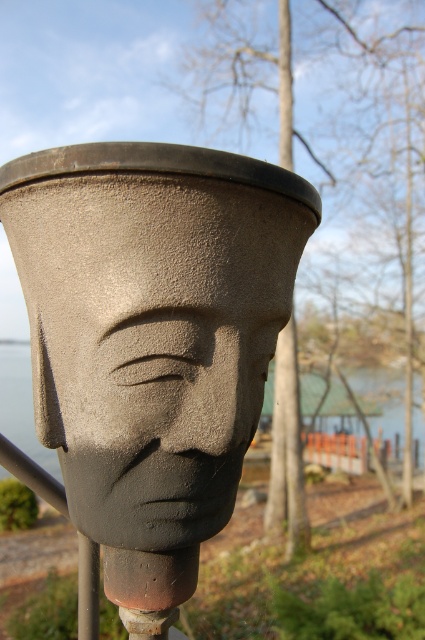
Question: Can you confirm if matte gray stone head at center is thinner than gray stone water at center?

Choices:
 (A) no
 (B) yes

Answer: (B)

Question: Which object appears closest to the camera in this image?

Choices:
 (A) gray stone water at center
 (B) matte gray stone head at center

Answer: (B)

Question: Can you confirm if matte gray stone head at center is wider than gray stone water at center?

Choices:
 (A) no
 (B) yes

Answer: (A)

Question: Is matte gray stone head at center positioned before gray stone water at center?

Choices:
 (A) no
 (B) yes

Answer: (B)